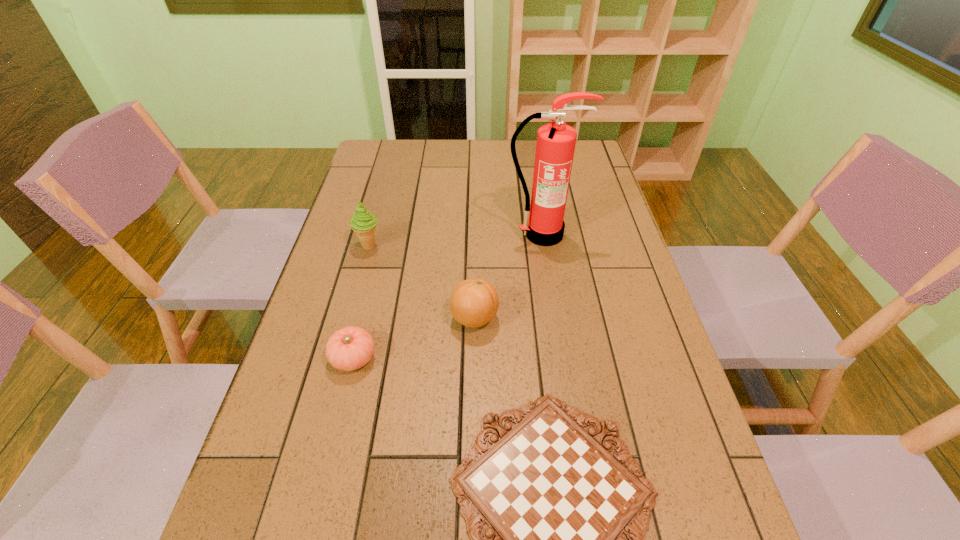
Locate an element on the screen. This screenshot has height=540, width=960. the tallest object is located at coordinates (543, 225).

You are a GUI agent. You are given a task and a screenshot of the screen. Output one action in this format:
    pyautogui.click(x=<x>, y=<y>)
    Task: Click on the second tallest object
    
    Given the screenshot: What is the action you would take?
    pos(363,223)

Locate an element on the screen. the third nearest object is located at coordinates (474, 302).

You are a GUI agent. You are given a task and a screenshot of the screen. Output one action in this format:
    pyautogui.click(x=<x>, y=<y>)
    Task: Click on the third tallest object
    This screenshot has width=960, height=540.
    Given the screenshot: What is the action you would take?
    pyautogui.click(x=474, y=302)

This screenshot has width=960, height=540. In order to click on tomato in this screenshot , I will do `click(350, 348)`.

The width and height of the screenshot is (960, 540). I want to click on the fourth tallest object, so (x=350, y=348).

The width and height of the screenshot is (960, 540). What are the coordinates of `free spot located 0.360m with the nozzle aimed from the tallest object` in the screenshot? It's located at (560, 349).

The width and height of the screenshot is (960, 540). I want to click on free space located on the left of the icecream, so click(x=331, y=246).

Locate an element on the screen. The image size is (960, 540). free space located on the left of the third tallest object is located at coordinates (328, 318).

This screenshot has width=960, height=540. I want to click on free space located 0.250m on the right of the tomato, so click(487, 358).